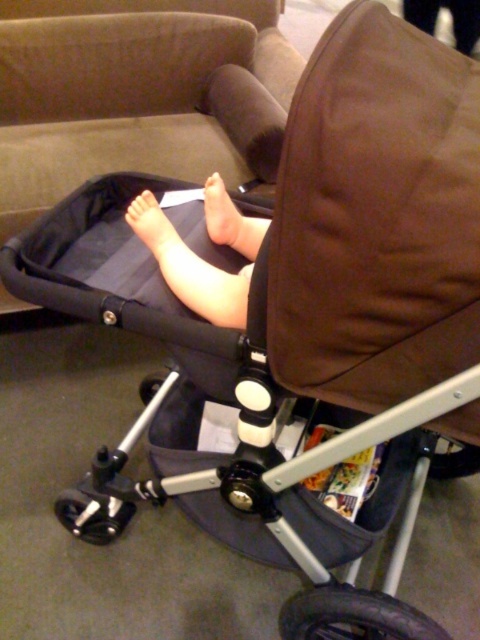
Question: Which object appears farthest from the camera in this image?

Choices:
 (A) matte skin foot at center
 (B) smooth skin foot at center
 (C) brown fabric couch at upper center
 (D) matte black foot at center

Answer: (C)

Question: Which object is closer to the camera taking this photo?

Choices:
 (A) matte skin foot at center
 (B) matte black foot at center

Answer: (B)

Question: Among these points, which one is farthest from the camera?

Choices:
 (A) (222, 225)
 (B) (145, 202)
 (C) (134, 13)

Answer: (C)

Question: Is smooth skin foot at center smaller than matte black foot at center?

Choices:
 (A) yes
 (B) no

Answer: (B)

Question: Does matte skin foot at center appear under matte black foot at center?

Choices:
 (A) no
 (B) yes

Answer: (A)

Question: Can you confirm if matte skin foot at center is positioned below matte black foot at center?

Choices:
 (A) yes
 (B) no

Answer: (B)